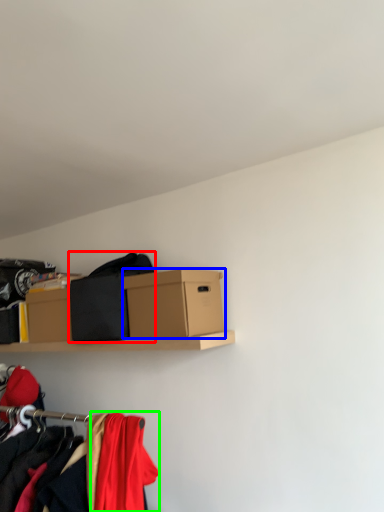
Question: Considering the real-world distances, which object is farthest from clothing (highlighted by a red box)? box (highlighted by a blue box) or clothing (highlighted by a green box)?

Choices:
 (A) box
 (B) clothing

Answer: (B)